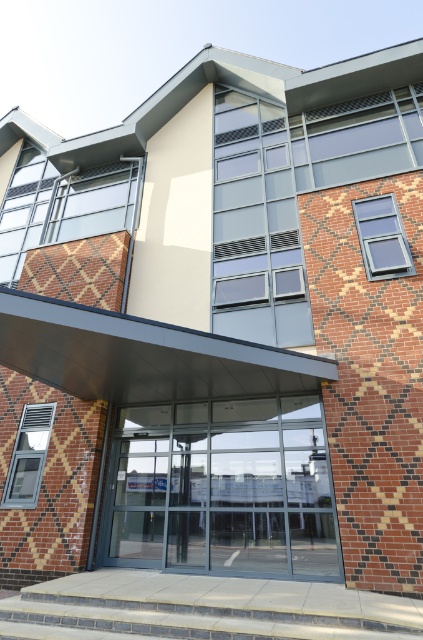
You are standing at the entrance of the modern building and need to reach the transparent glass door at center. The gray concrete stairs at lower center are in front of you. Should you go up or down the stairs to reach the door?

The transparent glass door at center is located above the gray concrete stairs at lower center, so you should go up the stairs to reach the door.

You are standing in front of the modern building and want to enter through the transparent glass door at center. Are the gray concrete stairs at lower center between you and the door?

The transparent glass door at center is further to the viewer than gray concrete stairs at lower center, meaning the stairs are not between you and the door. You can approach the door directly without needing to go around the stairs.